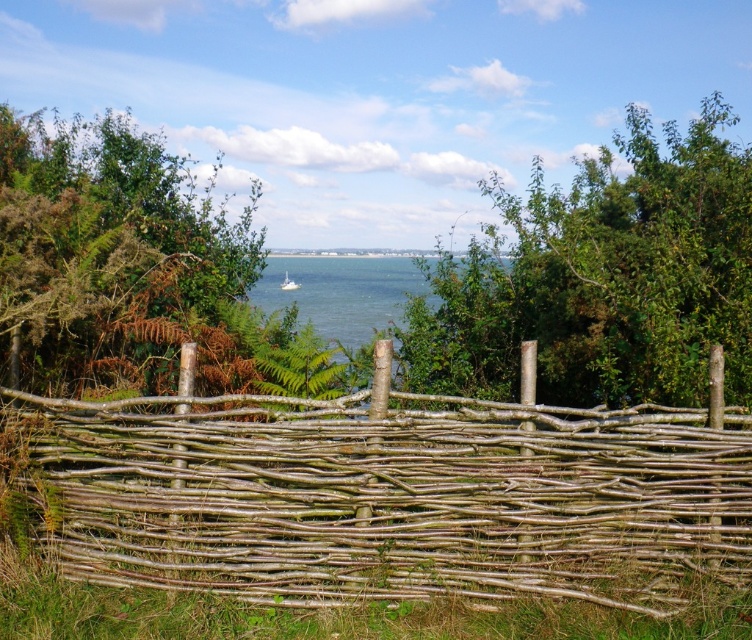
Is point (470, 593) positioned after point (314, 312)?

No, (470, 593) is in front of (314, 312).

Does point (243, 456) come closer to viewer compared to point (387, 321)?

Yes, it is in front of point (387, 321).

Where is `natural wood fence at center`? This screenshot has height=640, width=752. natural wood fence at center is located at coordinates (393, 493).

Is the position of green leafy bush at upper left less distant than that of clear blue water at center?

Yes, it is.

Does point (23, 120) come closer to viewer compared to point (411, 292)?

No, it is not.

Describe the element at coordinates (114, 259) in the screenshot. The height and width of the screenshot is (640, 752). I see `green leafy bush at upper left` at that location.

Locate an element on the screen. The width and height of the screenshot is (752, 640). green leafy bush at upper left is located at coordinates (114, 259).

Can you confirm if natural wood fence at center is bigger than green leafy tree at center?

No.

Is natural wood fence at center to the left of green leafy tree at center from the viewer's perspective?

Yes, natural wood fence at center is to the left of green leafy tree at center.

Locate an element on the screen. The height and width of the screenshot is (640, 752). natural wood fence at center is located at coordinates (393, 493).

You are a GUI agent. You are given a task and a screenshot of the screen. Output one action in this format:
    pyautogui.click(x=<x>, y=<y>)
    Task: Click on the natural wood fence at center
    
    Given the screenshot: What is the action you would take?
    pyautogui.click(x=393, y=493)